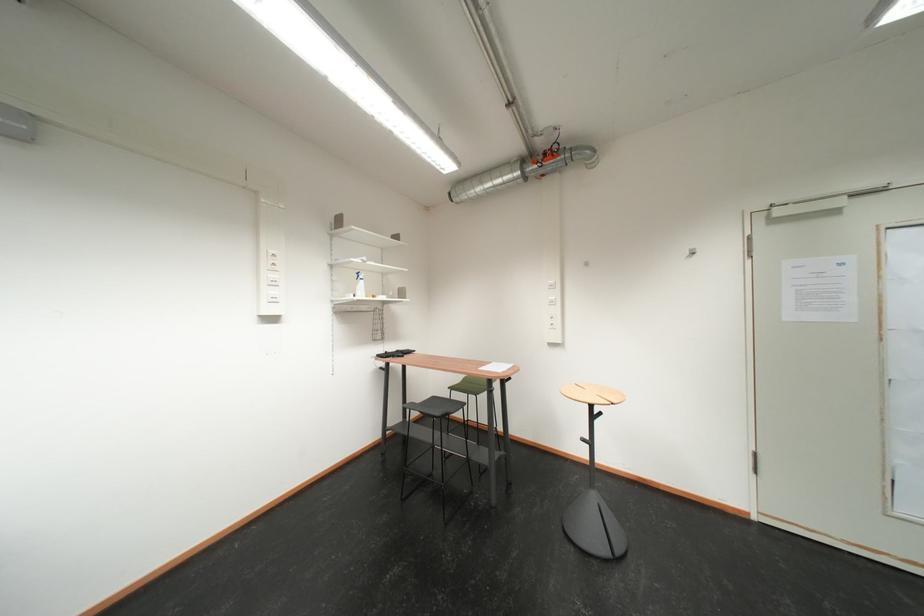
You are a GUI agent. You are given a task and a screenshot of the screen. Output one action in this format:
    pyautogui.click(x=<x>, y=<y>)
    Task: Click on the orange valve handle
    The height and width of the screenshot is (616, 924).
    Given the screenshot: What is the action you would take?
    pyautogui.click(x=548, y=166)